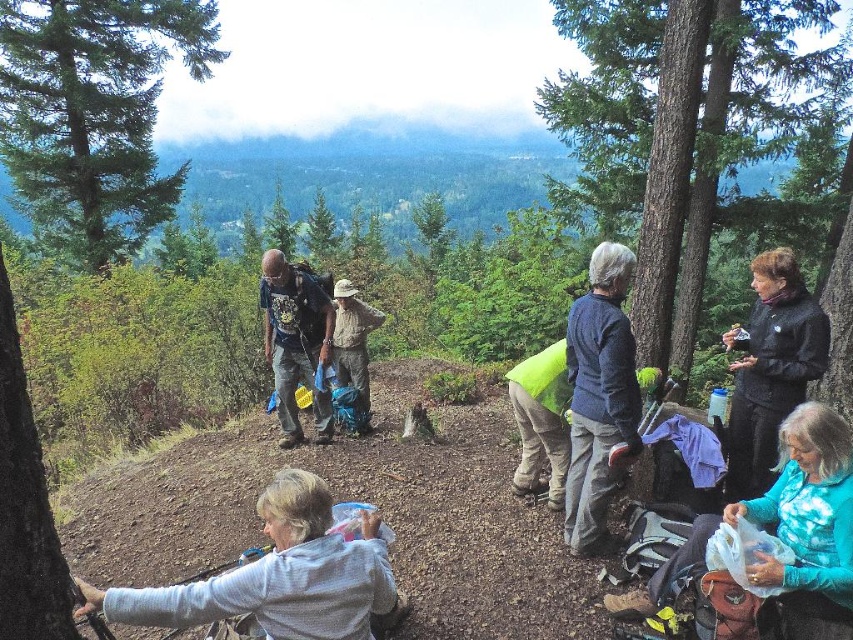
Between teal fabric jacket at lower right and brushed metal backpack at center, which one appears on the right side from the viewer's perspective?

From the viewer's perspective, teal fabric jacket at lower right appears more on the right side.

Does teal fabric jacket at lower right have a lesser width compared to brushed metal backpack at center?

In fact, teal fabric jacket at lower right might be wider than brushed metal backpack at center.

What do you see at coordinates (764, 552) in the screenshot? Image resolution: width=853 pixels, height=640 pixels. I see `teal fabric jacket at lower right` at bounding box center [764, 552].

This screenshot has height=640, width=853. I want to click on teal fabric jacket at lower right, so click(764, 552).

Is point (775, 8) less distant than point (41, 580)?

That is False.

Who is more distant from viewer, (679, 292) or (0, 481)?

The point (679, 292) is behind.

Is point (752, 115) farther from viewer compared to point (22, 464)?

That is True.

Where is `smooth bark tree at upper right`? The image size is (853, 640). smooth bark tree at upper right is located at coordinates (683, 124).

Does green coniferous tree at upper left appear over blue sweater at center?

Correct, green coniferous tree at upper left is located above blue sweater at center.

At what (x,y) coordinates should I click in order to perform the action: click on green coniferous tree at upper left. Please return your answer as a coordinate pair (x, y). The image size is (853, 640). Looking at the image, I should click on (94, 115).